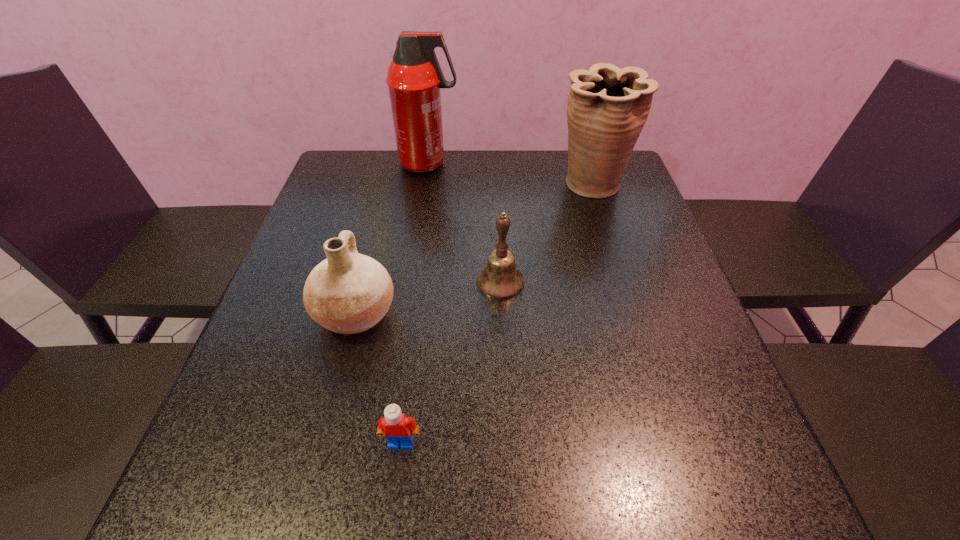
Locate an element on the screen. free space at the right edge of the desktop is located at coordinates (613, 223).

In the image, there is a desktop. What are the coordinates of `vacant space at the far left corner` in the screenshot? It's located at (378, 169).

In the image, there is a desktop. Where is `free space at the near right corner`? free space at the near right corner is located at coordinates (667, 486).

At what (x,y) coordinates should I click in order to perform the action: click on free space between the bell and the tallest object. Please return your answer as a coordinate pair (x, y). Looking at the image, I should click on (465, 223).

The image size is (960, 540). In order to click on free spot between the Lego and the rightmost object in this screenshot , I will do coord(496,314).

Image resolution: width=960 pixels, height=540 pixels. What are the coordinates of `vacant space that's between the pottery and the Lego` in the screenshot? It's located at (378, 378).

At what (x,y) coordinates should I click in order to perform the action: click on free point between the pottery and the tallest object. Please return your answer as a coordinate pair (x, y). The image size is (960, 540). Looking at the image, I should click on (392, 239).

Identify the location of free space between the fourth object from left to right and the pottery. The image size is (960, 540). (428, 298).

This screenshot has width=960, height=540. In order to click on vacant space in between the pottery and the shortest object in this screenshot , I will do `click(378, 378)`.

The image size is (960, 540). Identify the location of vacant space that's between the second object from right to left and the tallest object. (465, 223).